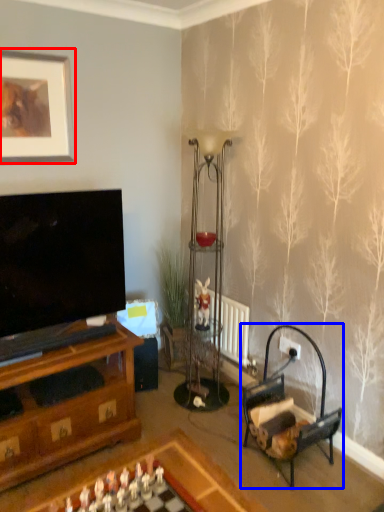
Question: Which point is closer to the camera, picture frame (highlighted by a red box) or armchair (highlighted by a blue box)?

Choices:
 (A) picture frame
 (B) armchair

Answer: (B)